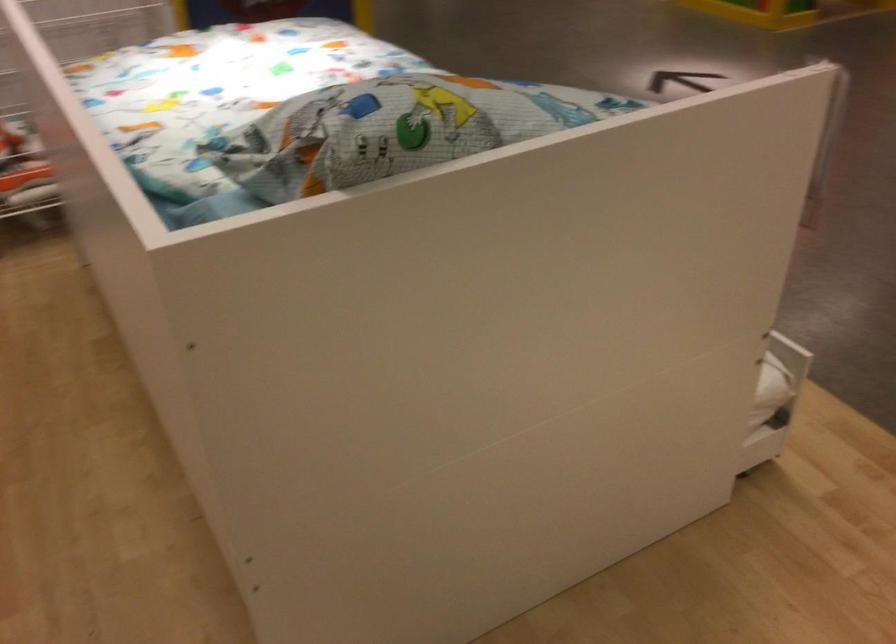
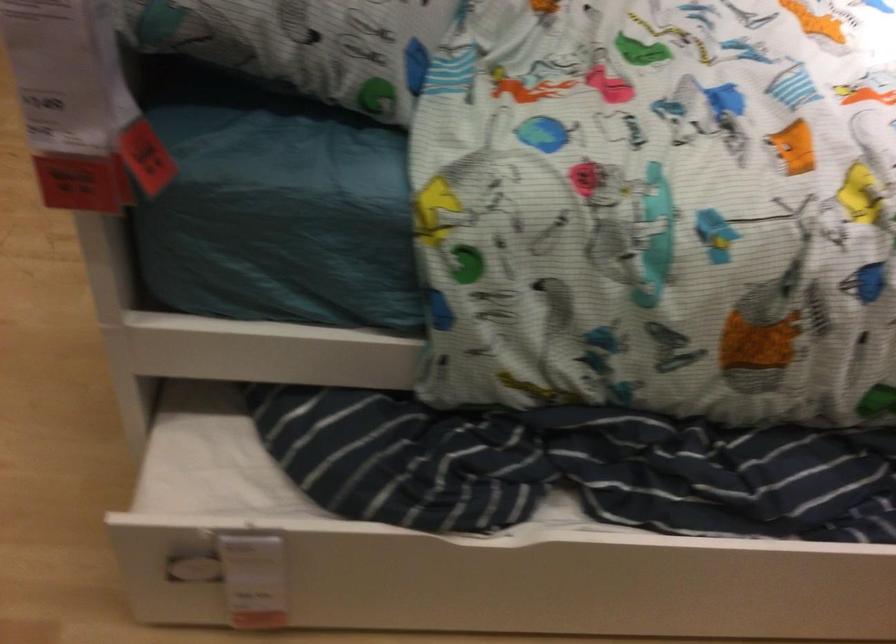
In the second image, find the point that corresponds to point (773, 353) in the first image.

(240, 574)